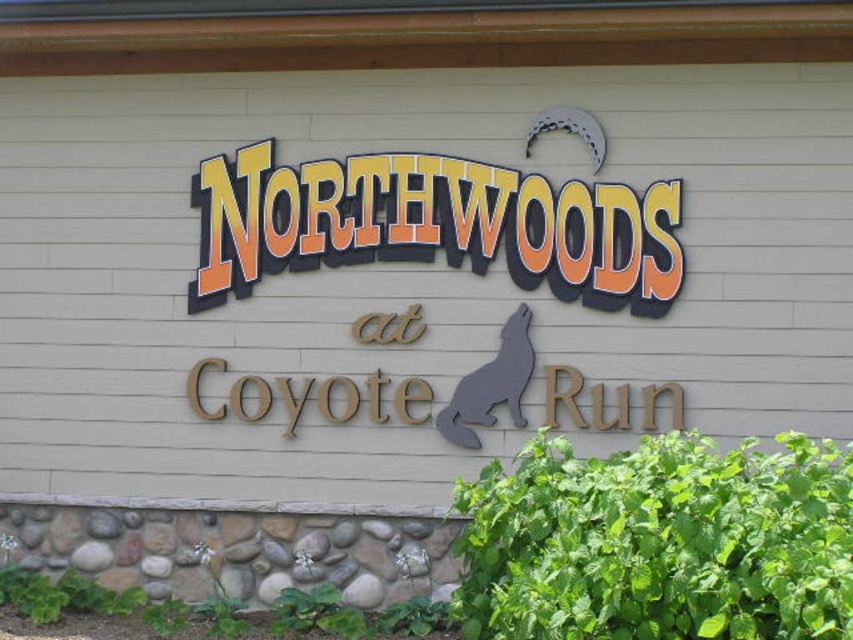
Question: Is orange brick sign at center smaller than wooden coyote at center?

Choices:
 (A) yes
 (B) no

Answer: (B)

Question: Is orange brick sign at center above wooden coyote at center?

Choices:
 (A) yes
 (B) no

Answer: (A)

Question: Among these points, which one is nearest to the camera?

Choices:
 (A) (263, 397)
 (B) (234, 182)

Answer: (A)

Question: Considering the relative positions of orange brick sign at center and wooden coyote at center in the image provided, where is orange brick sign at center located with respect to wooden coyote at center?

Choices:
 (A) right
 (B) left

Answer: (A)